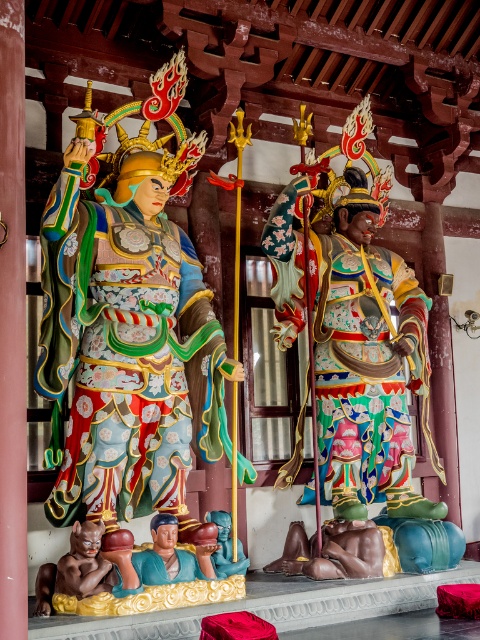
You are an art restorer working in the temple. You need to move both the multicolored painted statue at center and the smooth blue statue at center to a storage room. The storage room entrance is narrow and only allows one statue to pass through at a time. Based on their sizes, which statue should you move first to ensure the other can fit through after?

The multicolored painted statue at center is bigger than the smooth blue statue at center, so you should move the smooth blue statue at center first through the narrow entrance, allowing the larger multicolored painted statue at center to pass afterward more easily.

Consider the image. You are standing at the entrance of the temple and want to place a small offering at the base of the multicolored painted statue at center. To do this, you need to walk straight from your current position. Is the point at coordinates point (365, 364) directly in front of you, or to your left or right?

The point at coordinates point (365, 364) is directly in front of you because it is where the multicolored painted statue at center is located.

You are standing in the temple and want to take a photo of both the multicolored painted statue at center and the smooth blue statue at center. If you face the statues, which one is on your left side?

The smooth blue statue at center is on your left side because the multicolored painted statue at center is positioned to its right.